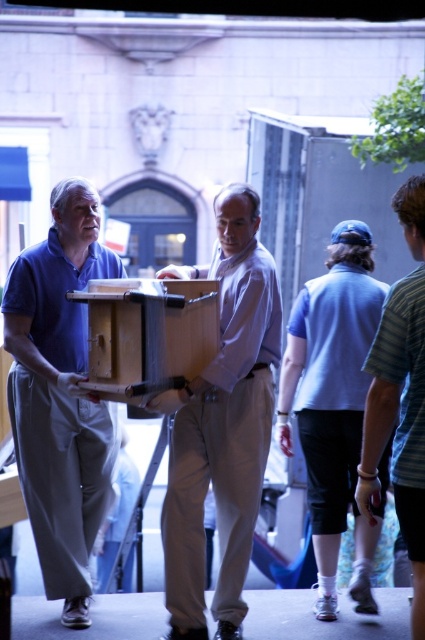
Question: Based on their relative distances, which object is farther from the wooden crate at center?

Choices:
 (A) light blue shirt at center
 (B) striped cotton shirt at right

Answer: (A)

Question: Considering the real-world distances, which object is farthest from the wooden crate at center?

Choices:
 (A) matte wood box at left
 (B) striped cotton shirt at right
 (C) light brown wood box at center
 (D) light blue shirt at center

Answer: (D)

Question: Can you confirm if light brown wood box at center is positioned to the right of striped cotton shirt at right?

Choices:
 (A) no
 (B) yes

Answer: (A)

Question: Does striped cotton shirt at right appear under wooden crate at center?

Choices:
 (A) yes
 (B) no

Answer: (A)

Question: Which of these objects is positioned closest to the matte wood box at left?

Choices:
 (A) wooden crate at center
 (B) striped cotton shirt at right

Answer: (A)

Question: Can you confirm if matte wood box at left is bigger than light blue shirt at center?

Choices:
 (A) yes
 (B) no

Answer: (B)